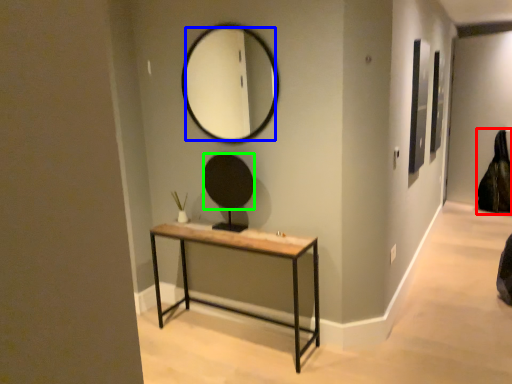
Question: Estimate the real-world distances between objects in this image. Which object is farther from swivel chair (highlighted by a red box), mirror (highlighted by a blue box) or mirror (highlighted by a green box)?

Choices:
 (A) mirror
 (B) mirror

Answer: (B)